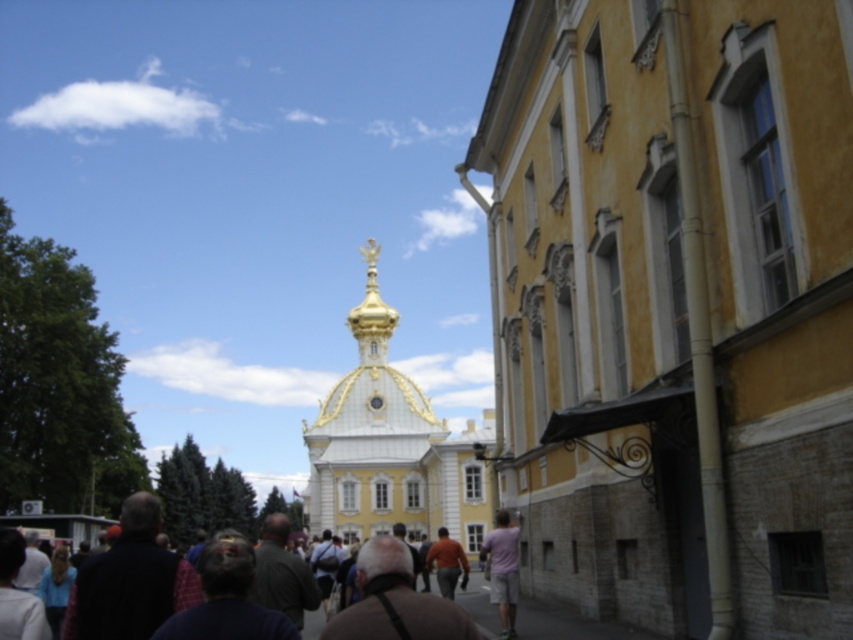
Question: Is yellow stucco church at center to the left of gold plated dome at center from the viewer's perspective?

Choices:
 (A) no
 (B) yes

Answer: (A)

Question: Can you confirm if gold plated dome at center is positioned below orange cotton shirt at center?

Choices:
 (A) yes
 (B) no

Answer: (B)

Question: Considering the real-world distances, which object is farthest from the orange cotton shirt at center?

Choices:
 (A) dark brown leather jacket at center
 (B) gold plated dome at center

Answer: (B)

Question: Which of the following is the farthest from the observer?

Choices:
 (A) gold plated dome at center
 (B) pink cotton shirt at center
 (C) yellow stucco church at center

Answer: (A)

Question: Which of the following is the farthest from the observer?

Choices:
 (A) [x=434, y=545]
 (B) [x=288, y=525]
 (C) [x=480, y=548]

Answer: (C)

Question: Is yellow stucco church at center above pink cotton shirt at center?

Choices:
 (A) yes
 (B) no

Answer: (A)